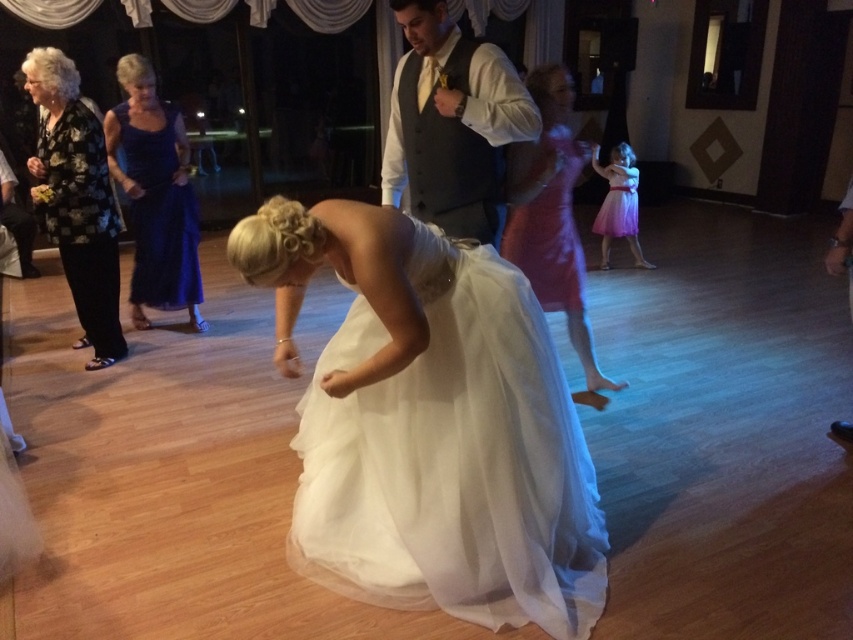
Question: Does black floral blouse at left lie behind matte pink dress at center?

Choices:
 (A) yes
 (B) no

Answer: (A)

Question: Which object appears farthest from the camera in this image?

Choices:
 (A) white tulle dress at center
 (B) matte pink tulle dress at center
 (C) matte white dress at right
 (D) matte gray vest at center

Answer: (C)

Question: Is blue satin dress at upper left to the right of purple tulle dress at right from the viewer's perspective?

Choices:
 (A) no
 (B) yes

Answer: (A)

Question: Does matte pink tulle dress at center come behind matte white dress at right?

Choices:
 (A) no
 (B) yes

Answer: (A)

Question: Which object is closer to the camera taking this photo?

Choices:
 (A) matte gray vest at center
 (B) white tulle dress at center

Answer: (B)

Question: Which of these objects is positioned closest to the matte pink dress at center?

Choices:
 (A) purple tulle dress at right
 (B) matte pink tulle dress at center
 (C) blue satin dress at upper left

Answer: (B)